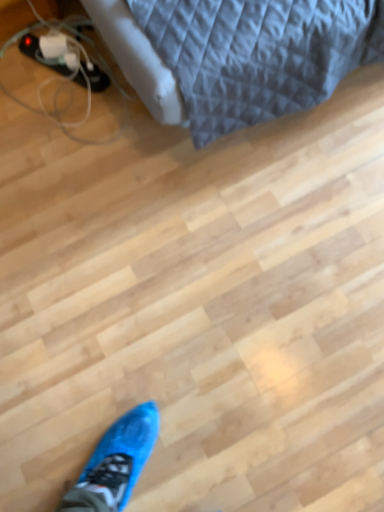
Locate an element on the screen. This screenshot has height=512, width=384. blank area to the left of matte black shoe at upper left is located at coordinates (23, 81).